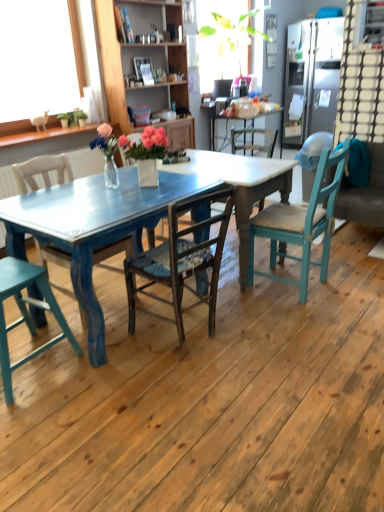
Question: From the image's perspective, would you say wooden cabinet at upper center is shown under teal painted wood chair at lower left, arranged as the 4th chair when viewed from the right?

Choices:
 (A) yes
 (B) no

Answer: (B)

Question: Is wooden cabinet at upper center bigger than teal painted wood chair at lower left, placed as the 1th chair when sorted from left to right?

Choices:
 (A) yes
 (B) no

Answer: (A)

Question: Could you tell me if wooden cabinet at upper center is facing teal painted wood chair at lower left, arranged as the 4th chair when viewed from the right?

Choices:
 (A) no
 (B) yes

Answer: (A)

Question: From a real-world perspective, is wooden cabinet at upper center over teal painted wood chair at lower left, placed as the 1th chair when sorted from left to right?

Choices:
 (A) no
 (B) yes

Answer: (B)

Question: Is wooden cabinet at upper center oriented away from teal painted wood chair at lower left, arranged as the 4th chair when viewed from the right?

Choices:
 (A) no
 (B) yes

Answer: (A)

Question: Is wooden cabinet at upper center positioned behind teal painted wood chair at lower left, placed as the 1th chair when sorted from left to right?

Choices:
 (A) no
 (B) yes

Answer: (B)

Question: Is teal fabric couch at right positioned behind teal wood chair at right, the 4th chair from the left?

Choices:
 (A) no
 (B) yes

Answer: (B)

Question: From a real-world perspective, is teal fabric couch at right over teal wood chair at right, which ranks as the first chair in right-to-left order?

Choices:
 (A) yes
 (B) no

Answer: (B)

Question: Would you say teal fabric couch at right is a long distance from teal wood chair at right, which ranks as the first chair in right-to-left order?

Choices:
 (A) yes
 (B) no

Answer: (B)

Question: Does teal fabric couch at right have a greater width compared to teal wood chair at right, the 4th chair from the left?

Choices:
 (A) yes
 (B) no

Answer: (A)

Question: Can you confirm if teal fabric couch at right is taller than teal wood chair at right, the 4th chair from the left?

Choices:
 (A) no
 (B) yes

Answer: (A)

Question: Is teal fabric couch at right not within teal wood chair at right, which ranks as the first chair in right-to-left order?

Choices:
 (A) no
 (B) yes

Answer: (B)

Question: Can you confirm if teal fabric couch at right is smaller than wooden chair at center, acting as the second chair starting from the right?

Choices:
 (A) yes
 (B) no

Answer: (B)